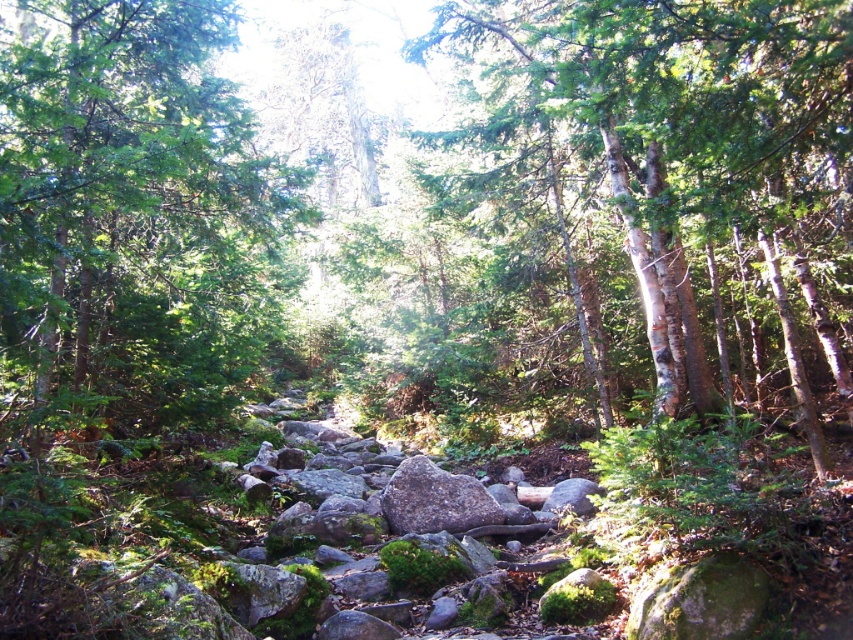
Question: Which object appears closest to the camera in this image?

Choices:
 (A) smooth bark tree at center
 (B) green leafy tree at center

Answer: (B)

Question: Is smooth bark tree at center to the right of green leafy tree at center from the viewer's perspective?

Choices:
 (A) yes
 (B) no

Answer: (A)

Question: Which of the following is the closest to the observer?

Choices:
 (A) smooth bark tree at center
 (B) green leafy tree at center

Answer: (B)

Question: Does smooth bark tree at center appear over green leafy tree at center?

Choices:
 (A) yes
 (B) no

Answer: (B)

Question: Where is smooth bark tree at center located in relation to green leafy tree at center in the image?

Choices:
 (A) left
 (B) right

Answer: (B)